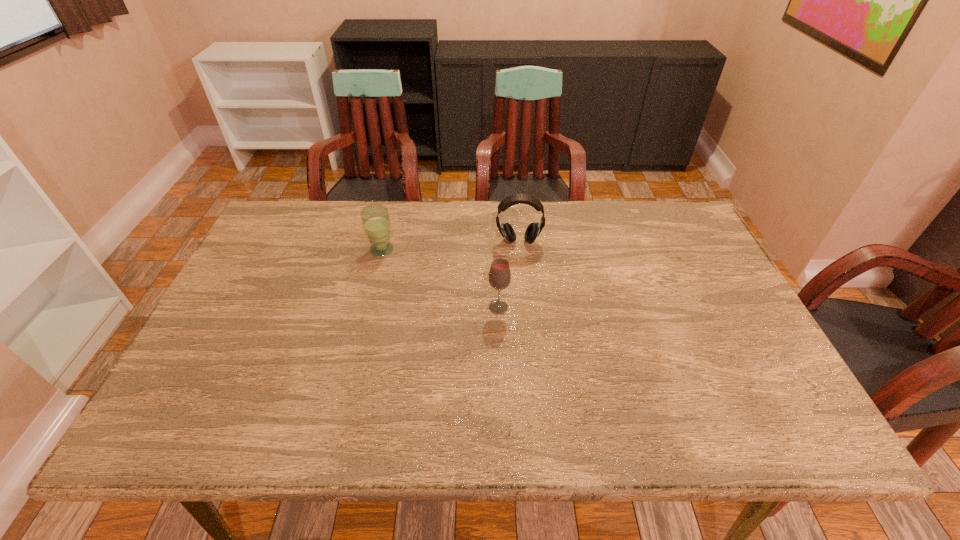
I want to click on vacant area at the far edge of the desktop, so click(x=576, y=210).

Image resolution: width=960 pixels, height=540 pixels. Find the location of `vacant space at the near edge`. vacant space at the near edge is located at coordinates (292, 409).

Where is `free space at the left edge of the desktop`? The image size is (960, 540). free space at the left edge of the desktop is located at coordinates (195, 393).

You are a GUI agent. You are given a task and a screenshot of the screen. Output one action in this format:
    pyautogui.click(x=<x>, y=<y>)
    Task: Click on the vacant region at the right edge of the desktop
    This screenshot has width=960, height=540.
    Given the screenshot: What is the action you would take?
    pyautogui.click(x=752, y=398)

In the image, there is a desktop. Where is `vacant space at the near left corner`? This screenshot has width=960, height=540. vacant space at the near left corner is located at coordinates (222, 409).

Identify the location of vacant space that is in between the earphone and the leftmost object. This screenshot has height=540, width=960. (450, 246).

Find the location of a particular element. This screenshot has width=960, height=540. vacant space that's between the farther glass and the earphone is located at coordinates (450, 246).

At what (x,y) coordinates should I click in order to perform the action: click on vacant space that is in between the leftmost object and the nearest object. Please return your answer as a coordinate pair (x, y). This screenshot has height=540, width=960. Looking at the image, I should click on [x=440, y=279].

The height and width of the screenshot is (540, 960). I want to click on empty space that is in between the farther glass and the right glass, so click(440, 279).

Where is `vacant area that lies between the farther glass and the earphone`? vacant area that lies between the farther glass and the earphone is located at coordinates (x=450, y=246).